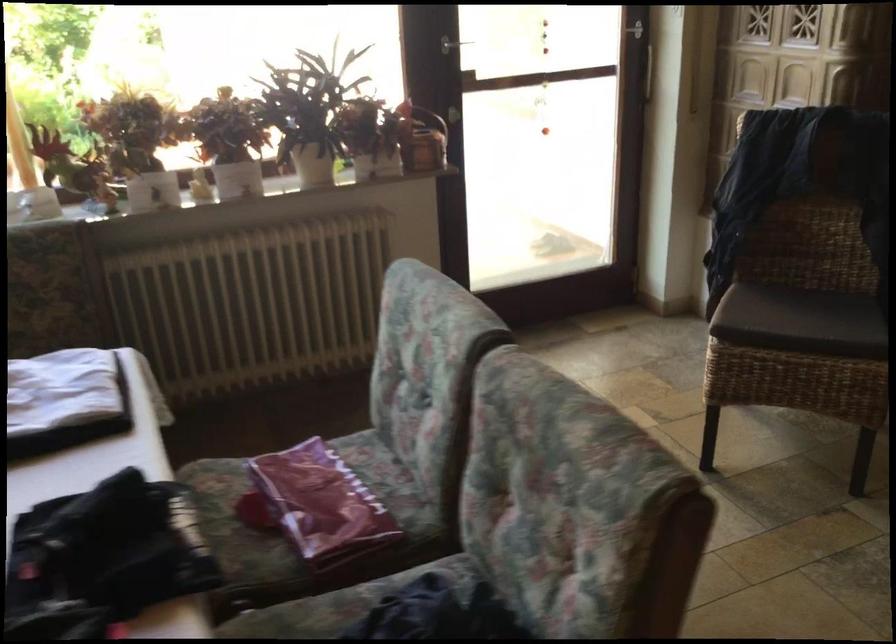
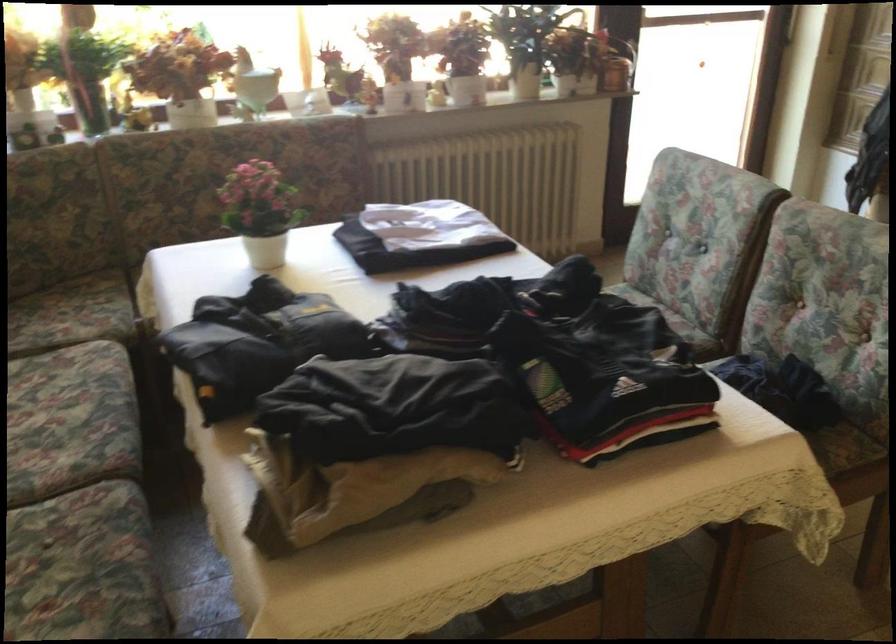
The point at (233, 172) is marked in the first image. Where is the corresponding point in the second image?

(467, 84)